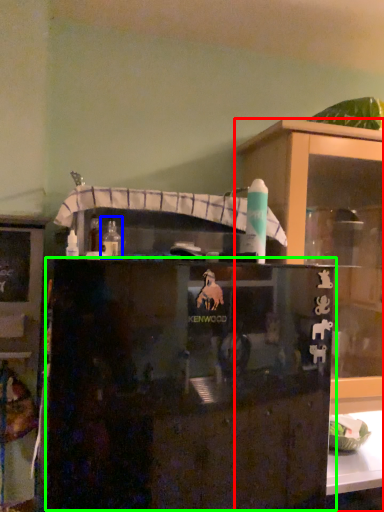
Question: Based on their relative distances, which object is nearer to cupboard (highlighted by a red box)? Choose from bottle (highlighted by a blue box) and cabinetry (highlighted by a green box).

Choices:
 (A) bottle
 (B) cabinetry

Answer: (B)